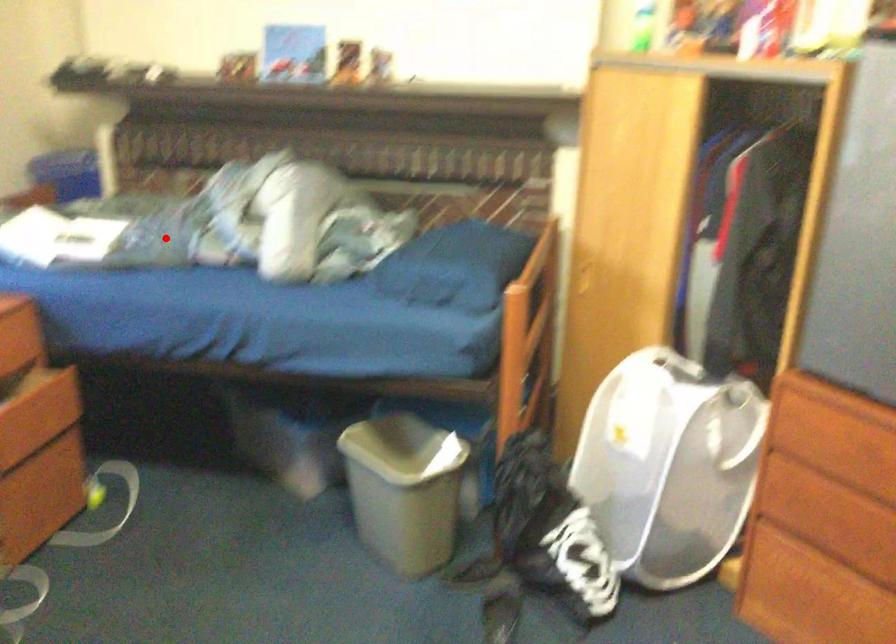
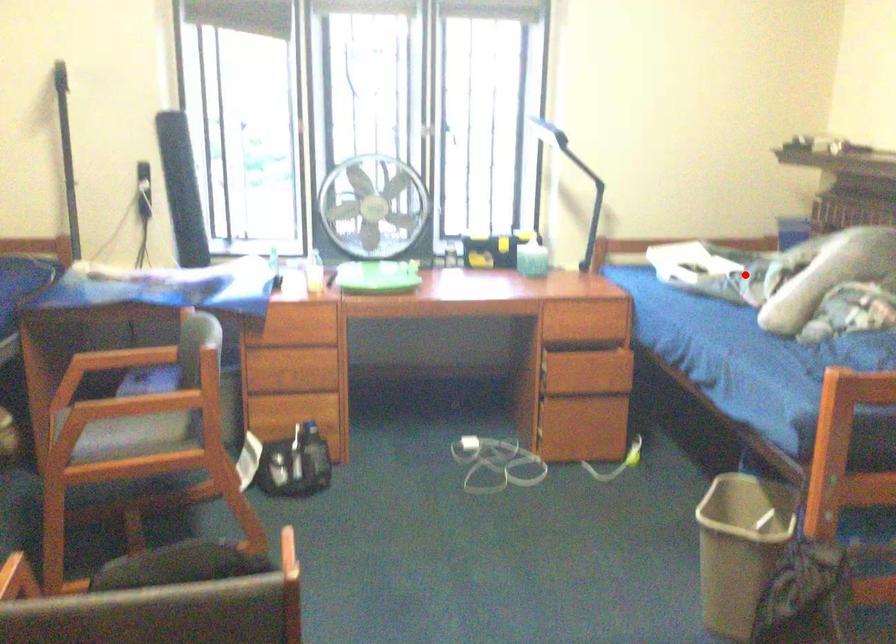
I am providing you with two images of the same scene from different viewpoints. A red point is marked on the first image and another point is marked on the second image. Is the red point in image1 aligned with the point shown in image2?

Yes